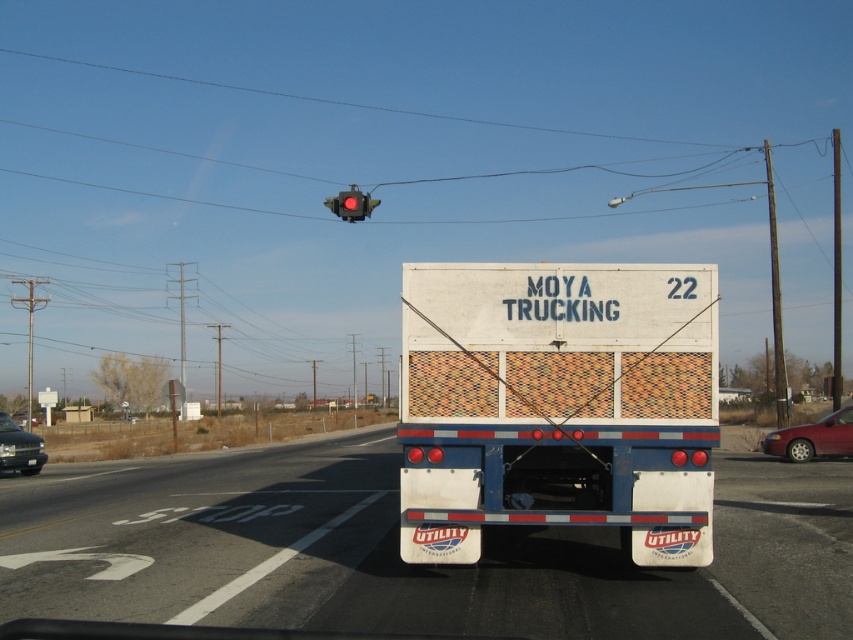
Is white utility trailer at center positioned at the back of white textured trailer truck at center?

No, white utility trailer at center is in front of white textured trailer truck at center.

Looking at this image, how far apart are white utility trailer at center and white textured trailer truck at center?

white utility trailer at center and white textured trailer truck at center are 4.20 meters apart.

Which is in front, point (585, 540) or point (584, 500)?

Positioned in front is point (584, 500).

Find the location of a particular element. This screenshot has height=640, width=853. white utility trailer at center is located at coordinates (397, 550).

Who is more distant from viewer, (618, 308) or (10, 451)?

The point (10, 451) is behind.

Between white textured trailer truck at center and metallic gray sedan at lower left, which one has more height?

Standing taller between the two is white textured trailer truck at center.

What are the coordinates of `white textured trailer truck at center` in the screenshot? It's located at (558, 404).

Can you confirm if metallic red sedan at right is positioned to the left of metallic gray sedan at lower left?

No, metallic red sedan at right is not to the left of metallic gray sedan at lower left.

Who is more distant from viewer, (808, 442) or (7, 419)?

The point (7, 419) is more distant.

Does point (793, 448) come farther from viewer compared to point (12, 433)?

That is False.

Locate an element on the screen. The height and width of the screenshot is (640, 853). metallic red sedan at right is located at coordinates (813, 436).